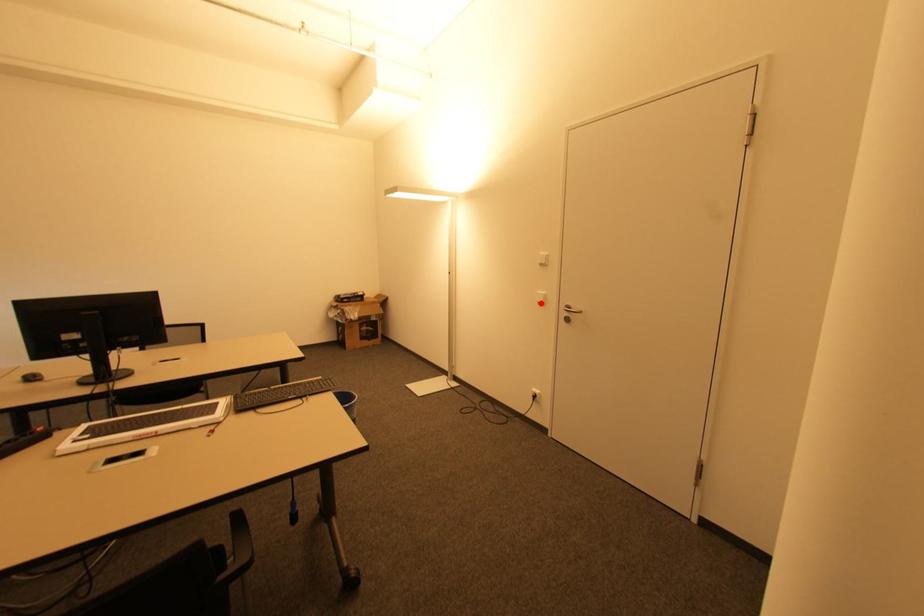
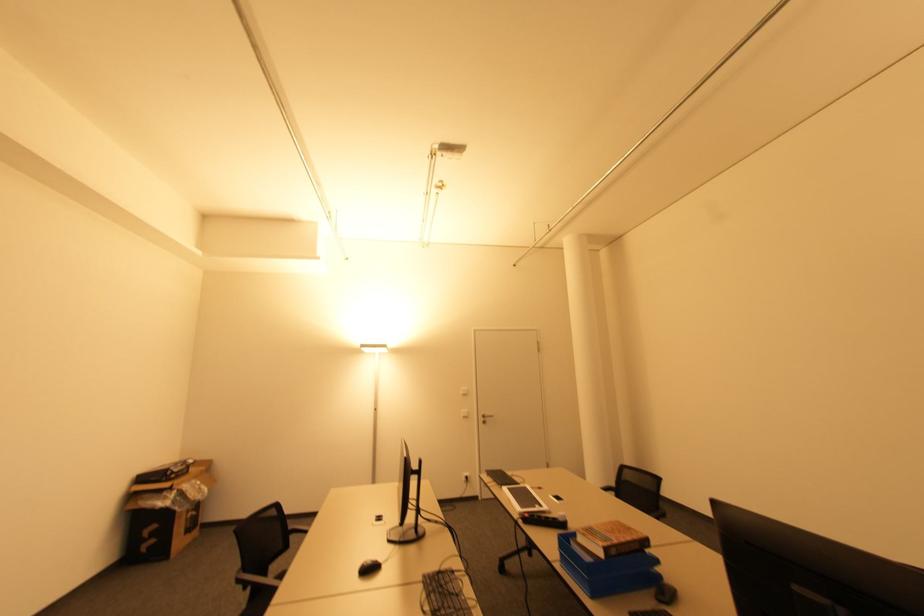
Question: A red point is marked in image1. In image2, is the corresponding 3D point closer to the camera or farther? Reply with the corresponding letter.

Choices:
 (A) The corresponding 3D point is closer.
 (B) The corresponding 3D point is farther.

Answer: (B)